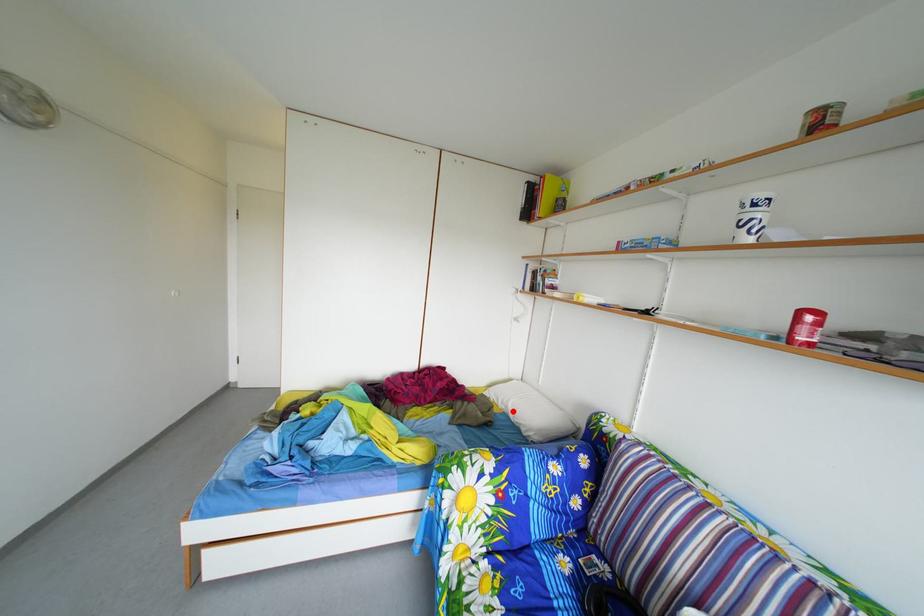
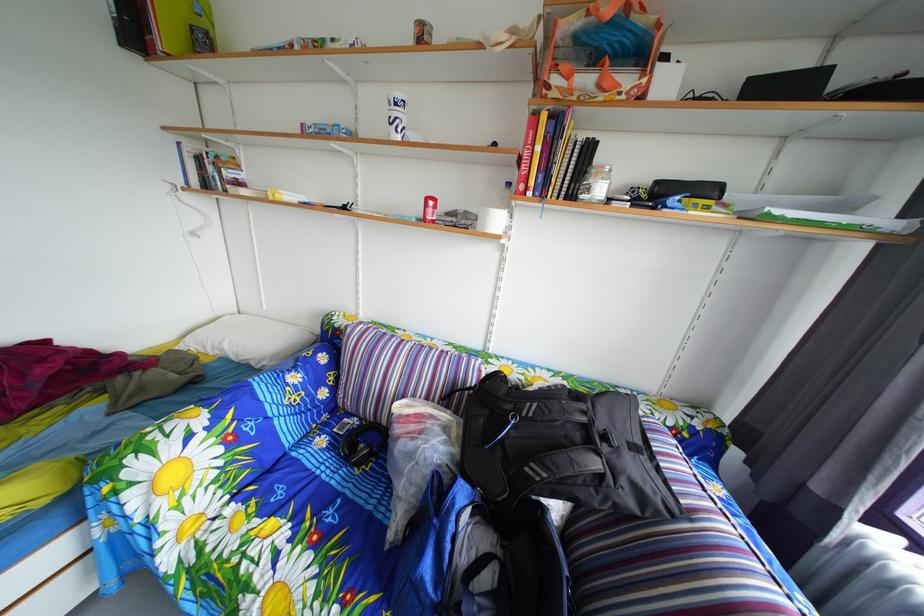
Question: A red point is marked in image1. In image2, is the corresponding 3D point closer to the camera or farther? Reply with the corresponding letter.

Choices:
 (A) The corresponding 3D point is closer.
 (B) The corresponding 3D point is farther.

Answer: (B)